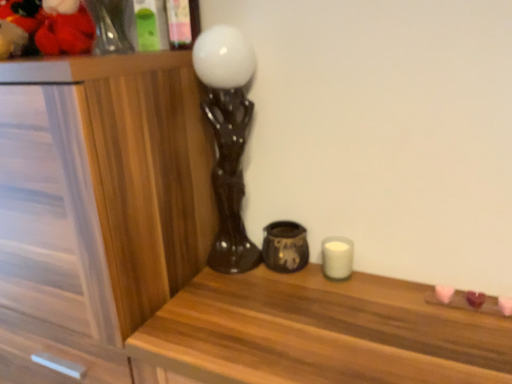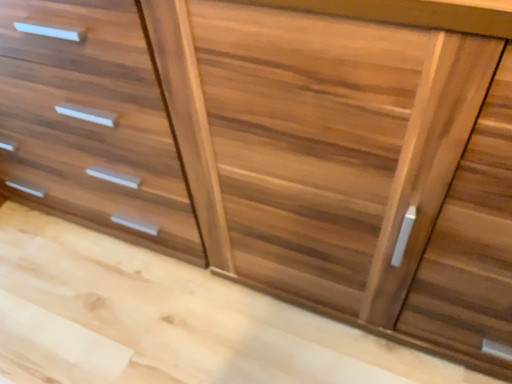
Question: Which way did the camera rotate in the video?

Choices:
 (A) rotated downward
 (B) rotated upward

Answer: (A)